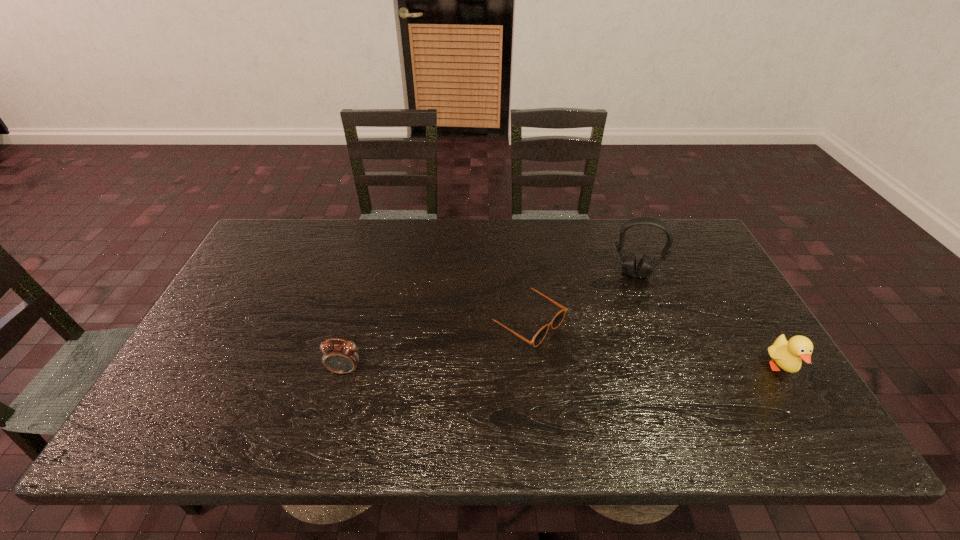
Find the location of a particular element. unoccupied area between the duckling and the third object from left to right is located at coordinates (708, 321).

Identify the location of vacant area between the farthest object and the duckling. This screenshot has width=960, height=540. (708, 321).

Locate which object is the second closest to the duckling. Please provide its 2D coordinates. Your answer should be formatted as a tuple, i.e. [(x, y)], where the tuple contains the x and y coordinates of a point satisfying the conditions above.

[(557, 320)]

You are a GUI agent. You are given a task and a screenshot of the screen. Output one action in this format:
    pyautogui.click(x=<x>, y=<y>)
    Task: Click on the object that is the closest to the duckling
    This screenshot has height=540, width=960.
    Given the screenshot: What is the action you would take?
    pyautogui.click(x=645, y=267)